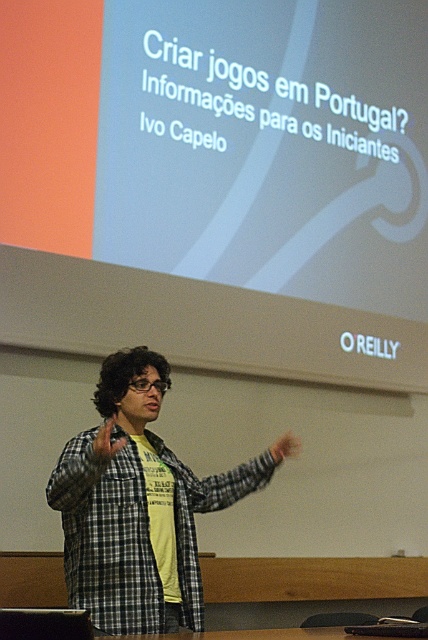
You are a photographer in a lecture hall. You need to take a photo of the presenter wearing a checkered fabric shirt at center and their brown leather hand at center. The camera you have can only focus on objects within 20 inches of each other. Will the two objects be in focus?

The checkered fabric shirt at center is 22.08 inches away from the brown leather hand at center. Since the distance between them exceeds the camera focus range of 20 inches, they will not both be in focus.

You are an attendee at the presentation. The speaker is wearing a checkered fabric shirt at center and has a brown leather hand at center. Which clothing item is more to the left?

The checkered fabric shirt at center is more to the left than the brown leather hand at center.